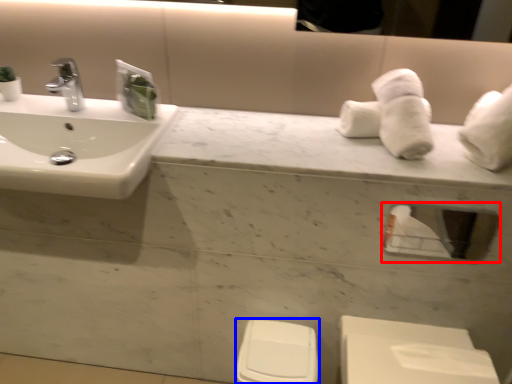
Question: Which object is closer to the camera taking this photo, mirror (highlighted by a red box) or toilet bowl (highlighted by a blue box)?

Choices:
 (A) mirror
 (B) toilet bowl

Answer: (A)